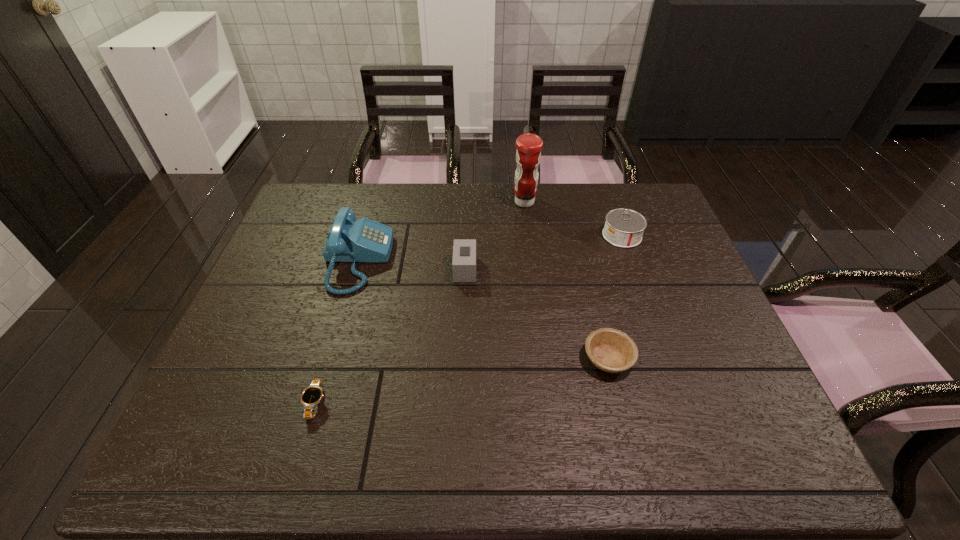
The width and height of the screenshot is (960, 540). What are the coordinates of `free location that satisfies the following two spatial constraints: 1. on the front side of the condiment; 2. on the right side of the fifth farthest object` in the screenshot? It's located at (543, 359).